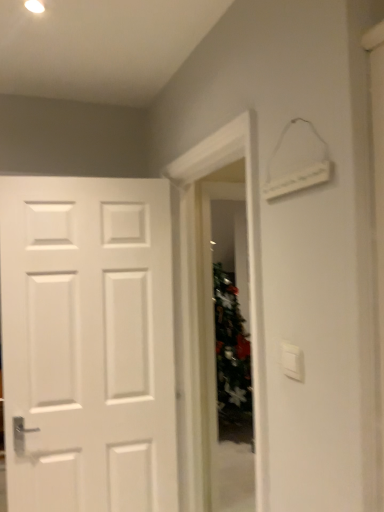
Question: Does point (283, 343) appear closer or farther from the camera than point (211, 300)?

Choices:
 (A) farther
 (B) closer

Answer: (B)

Question: From the image's perspective, is white plastic light switch at upper right positioned above or below green frosted glass door at center?

Choices:
 (A) below
 (B) above

Answer: (B)

Question: Based on their positions, is white plastic light switch at upper right located to the left or right of green frosted glass door at center?

Choices:
 (A) right
 (B) left

Answer: (A)

Question: Considering their positions, is green frosted glass door at center located in front of or behind white plastic light switch at upper right?

Choices:
 (A) behind
 (B) front

Answer: (A)

Question: Is green frosted glass door at center inside the boundaries of white plastic light switch at upper right, or outside?

Choices:
 (A) inside
 (B) outside

Answer: (B)

Question: Is green frosted glass door at center taller or shorter than white plastic light switch at upper right?

Choices:
 (A) short
 (B) tall

Answer: (B)

Question: Is point (230, 442) closer or farther from the camera than point (286, 358)?

Choices:
 (A) farther
 (B) closer

Answer: (A)